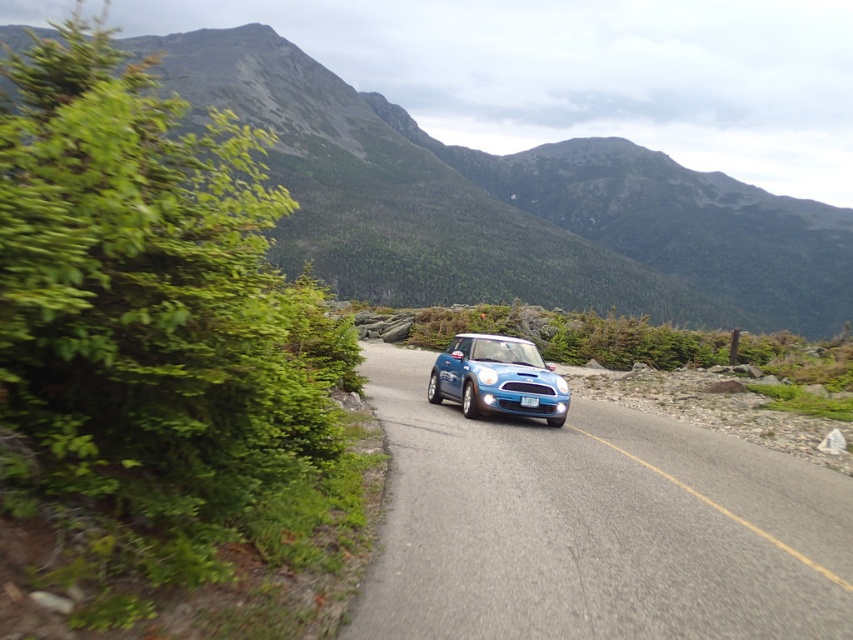
Does green forested mountain at upper center have a lesser height compared to blue plastic license plate at center?

No.

This screenshot has width=853, height=640. I want to click on green forested mountain at upper center, so click(x=509, y=205).

You are a GUI agent. You are given a task and a screenshot of the screen. Output one action in this format:
    pyautogui.click(x=<x>, y=<y>)
    Task: Click on the green forested mountain at upper center
    Image resolution: width=853 pixels, height=640 pixels.
    Given the screenshot: What is the action you would take?
    [x=509, y=205]

Is metallic blue car at center shorter than matte blue car at center?

Yes.

Which is in front, point (463, 445) or point (444, 369)?

Point (463, 445) is in front.

This screenshot has width=853, height=640. What do you see at coordinates (595, 525) in the screenshot? I see `metallic blue car at center` at bounding box center [595, 525].

Find the location of a particular element. The height and width of the screenshot is (640, 853). metallic blue car at center is located at coordinates (595, 525).

In the scene shown: Between matte blue car at center and blue plastic license plate at center, which one has more height?

Standing taller between the two is matte blue car at center.

Is the position of matte blue car at center less distant than that of blue plastic license plate at center?

No, matte blue car at center is behind blue plastic license plate at center.

At what (x,y) coordinates should I click in order to perform the action: click on matte blue car at center. Please return your answer as a coordinate pair (x, y). Image resolution: width=853 pixels, height=640 pixels. Looking at the image, I should click on (497, 378).